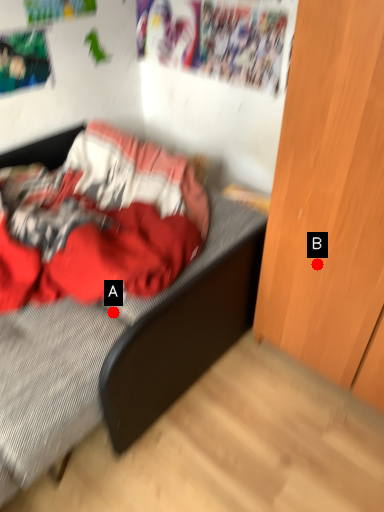
Question: Two points are circled on the image, labeled by A and B beside each circle. Which of the following is the closest to the observer?

Choices:
 (A) A is closer
 (B) B is closer

Answer: (B)